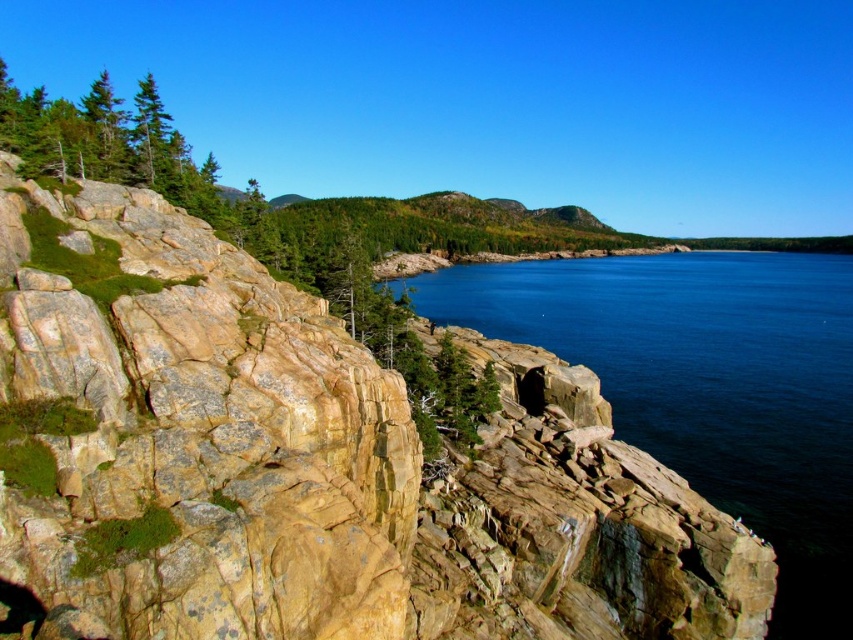
Question: Which point is farther from the camera taking this photo?

Choices:
 (A) (103, 532)
 (B) (769, 378)

Answer: (B)

Question: Is yellowish rock at left behind blue smooth water at center?

Choices:
 (A) no
 (B) yes

Answer: (A)

Question: Is yellowish rock at left thinner than blue smooth water at center?

Choices:
 (A) no
 (B) yes

Answer: (B)

Question: Which point is closer to the camera taking this photo?

Choices:
 (A) (277, 627)
 (B) (648, 400)

Answer: (A)

Question: In this image, where is yellowish rock at left located relative to blue smooth water at center?

Choices:
 (A) right
 (B) left

Answer: (B)